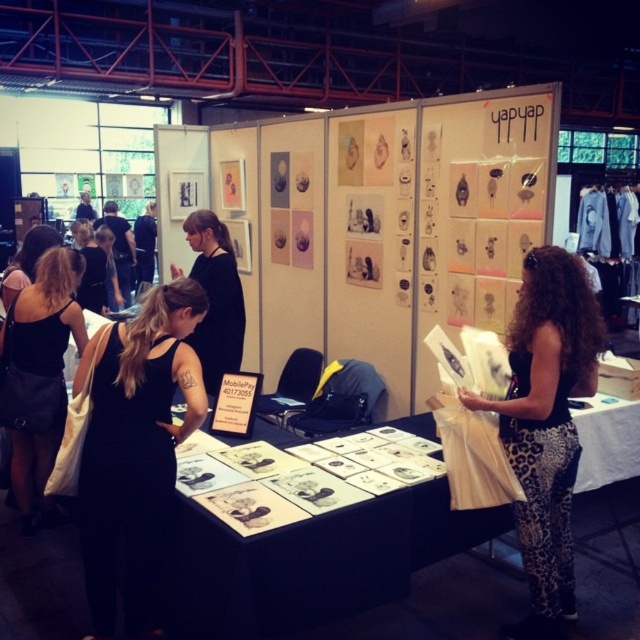
Question: Can you confirm if black matte dress at center is positioned below black leather dress at left?

Choices:
 (A) yes
 (B) no

Answer: (A)

Question: Can you confirm if leopard print pants at center is smaller than black leather dress at left?

Choices:
 (A) no
 (B) yes

Answer: (B)

Question: Does black matte dress at center appear on the right side of black leather dress at left?

Choices:
 (A) yes
 (B) no

Answer: (A)

Question: Which of these objects is positioned farthest from the black leather dress at left?

Choices:
 (A) leopard print pants at center
 (B) white paper at center

Answer: (A)

Question: Estimate the real-world distances between objects in this image. Which object is closer to the white paper at center?

Choices:
 (A) black matte dress at center
 (B) leopard print pants at center
 (C) black leather dress at left

Answer: (A)

Question: Which of these objects is positioned closest to the black matte dress at center?

Choices:
 (A) leopard print pants at center
 (B) black leather dress at left

Answer: (B)